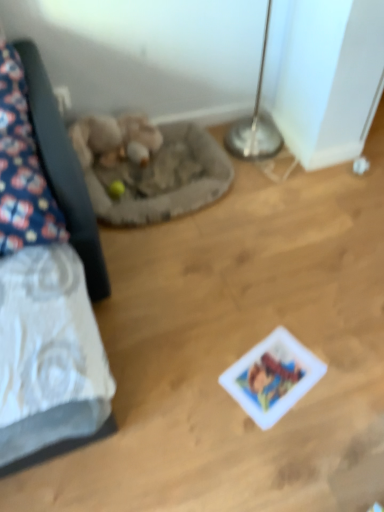
Locate an element on the screen. This screenshot has width=384, height=512. free spot above white glossy card at center (from a real-world perspective) is located at coordinates (277, 374).